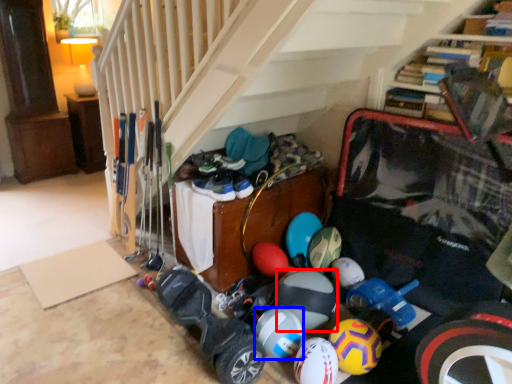
Question: Which point is closer to the camera, beach ball (highlighted by a red box) or bowling ball (highlighted by a blue box)?

Choices:
 (A) beach ball
 (B) bowling ball

Answer: (B)